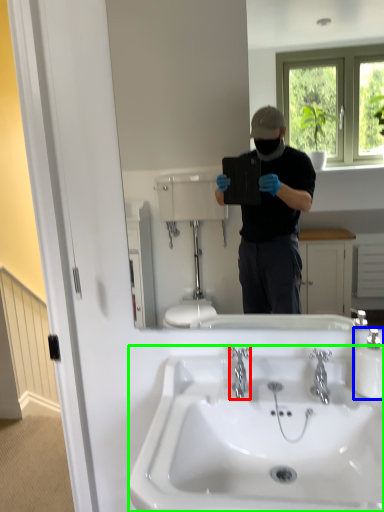
Question: Which is farther away from plumbing fixture (highlighted by a red box)? bottle (highlighted by a blue box) or sink (highlighted by a green box)?

Choices:
 (A) bottle
 (B) sink

Answer: (A)